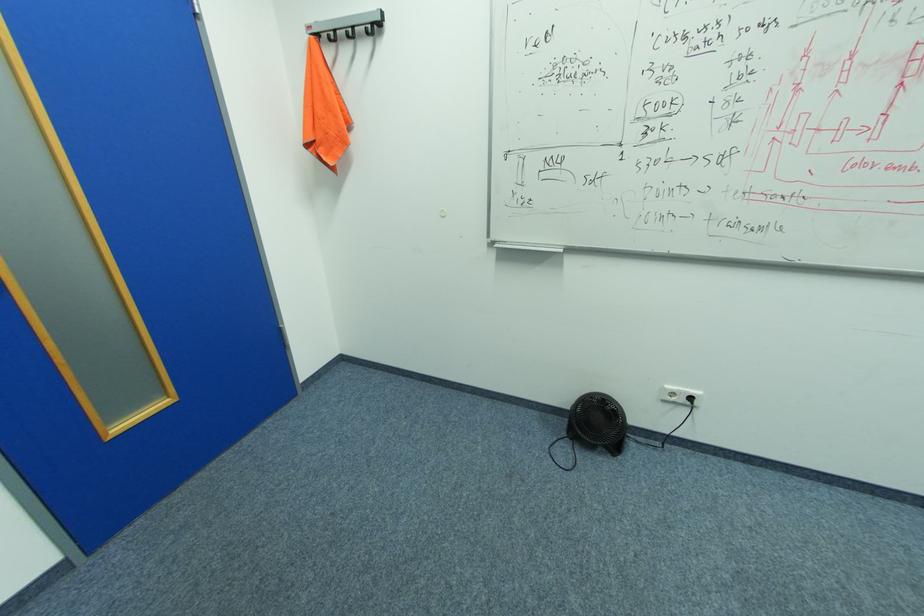
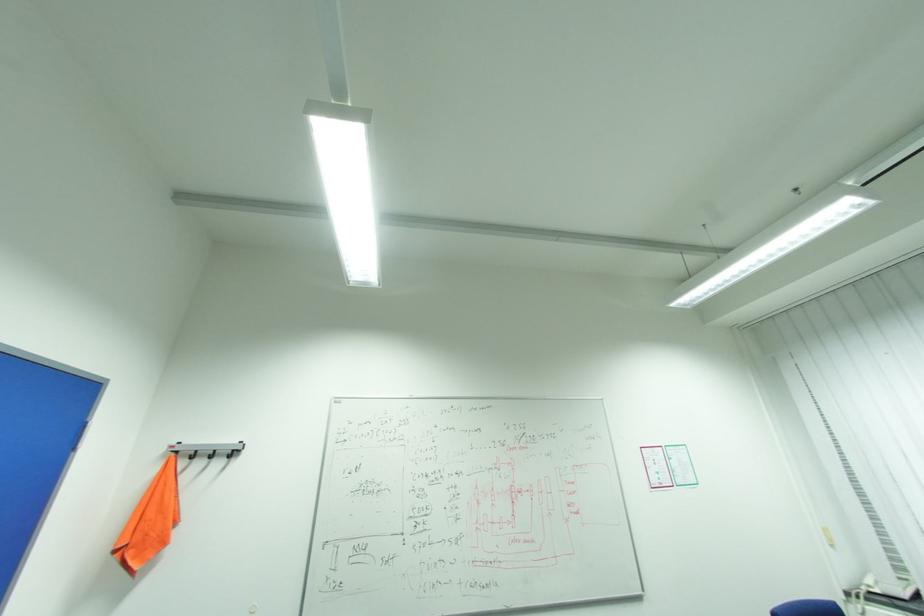
Based on the continuous images, in which direction is the camera rotating?

The camera's rotation is toward right-up.